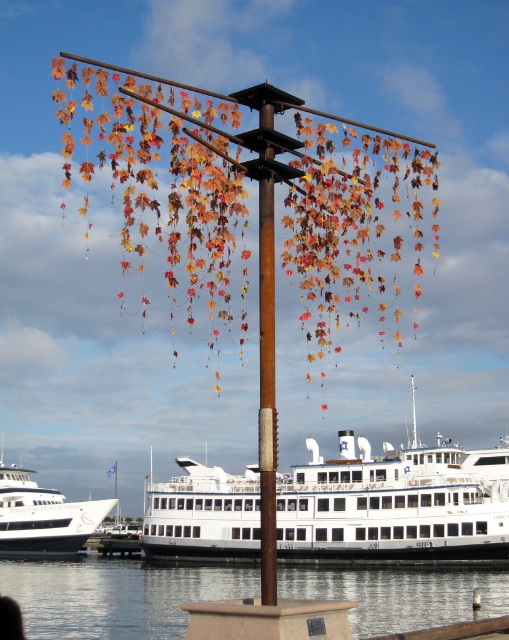
Consider the image. You are a tourist standing at the harbor and want to take a photo of both the white matte ferry at center and the white glossy ferry at lower left. Which ferry should you focus on first if you want to capture both in the frame without adjusting your camera angle?

You should focus on the white glossy ferry at lower left first because it is shorter than the white matte ferry at center, allowing both to fit within the frame without obstruction.

You are a photographer trying to capture the entire scene in one shot. Given that your camera can only focus on objects within a 10 meter width, and you know the transparent glass water at lower center and the white glossy ferry at lower left are both within this range, which object would require you to adjust your focus settings to accommodate its size?

The transparent glass water at lower center has a larger width than the white glossy ferry at lower left, so you would need to adjust your focus settings to accommodate its size to ensure it fits within the 10 meter width range.

You are standing at the point marked by the coordinates point (394,504). Looking around, you see the white matte ferry at center. Which direction should you walk to reach the nearest dry land?

The white matte ferry at center is represented by point (394,504). To reach the nearest dry land, you should walk away from the ferry towards the shore.